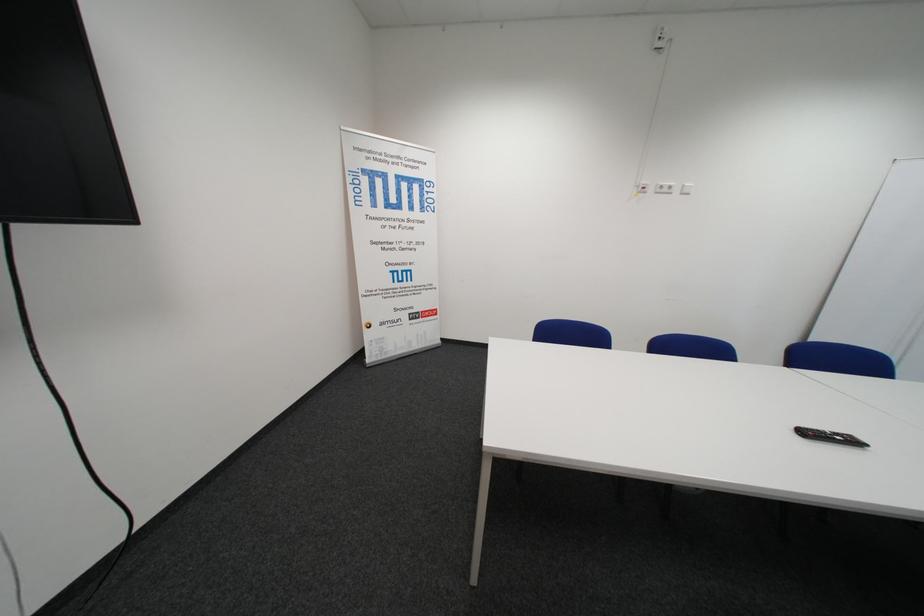
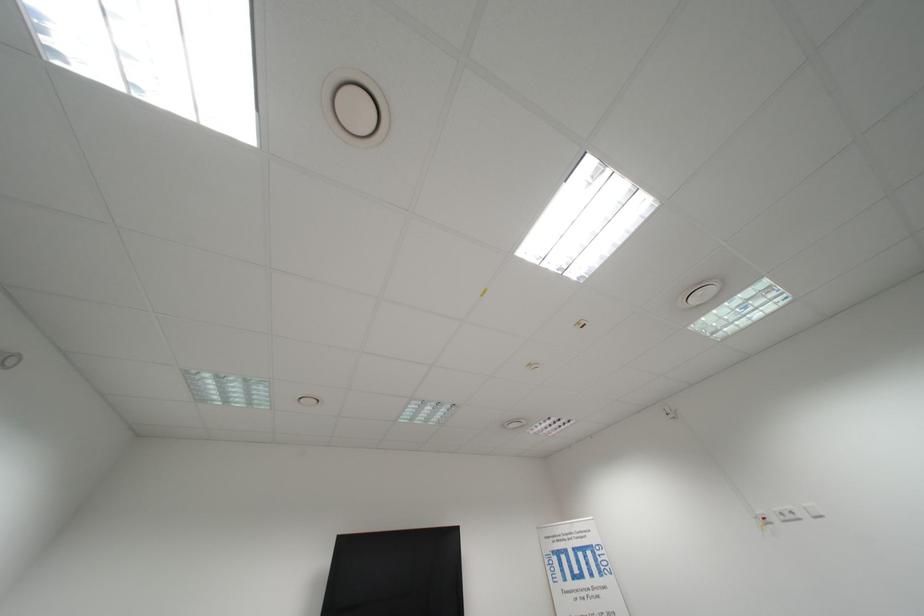
Locate, in the second image, the point that corresponds to the point at 671,192 in the first image.

(796, 519)